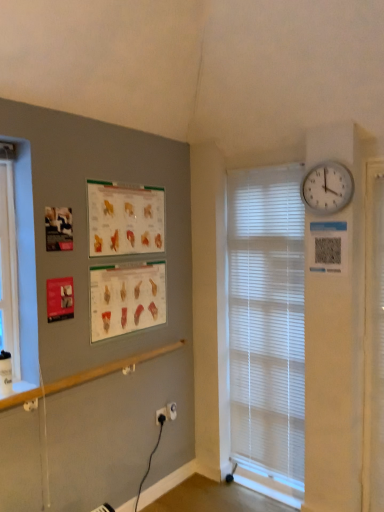
Question: Is white plastic electric outlet at lower center positioned behind white plastic wall clock at upper right?

Choices:
 (A) no
 (B) yes

Answer: (B)

Question: Can you confirm if white plastic electric outlet at lower center is wider than white plastic wall clock at upper right?

Choices:
 (A) yes
 (B) no

Answer: (A)

Question: Is white plastic electric outlet at lower center not close to white plastic wall clock at upper right?

Choices:
 (A) no
 (B) yes

Answer: (B)

Question: From a real-world perspective, is white plastic electric outlet at lower center on top of white plastic wall clock at upper right?

Choices:
 (A) no
 (B) yes

Answer: (A)

Question: Is white plastic electric outlet at lower center positioned in front of white plastic wall clock at upper right?

Choices:
 (A) no
 (B) yes

Answer: (A)

Question: Based on their positions, is white plastic bay window at left located to the left or right of white plastic blinds at center?

Choices:
 (A) left
 (B) right

Answer: (A)

Question: Is white plastic bay window at left bigger or smaller than white plastic blinds at center?

Choices:
 (A) small
 (B) big

Answer: (A)

Question: From a real-world perspective, relative to white plastic blinds at center, is white plastic bay window at left vertically above or below?

Choices:
 (A) above
 (B) below

Answer: (A)

Question: Is point (4, 272) closer or farther from the camera than point (286, 467)?

Choices:
 (A) farther
 (B) closer

Answer: (B)

Question: Is white plastic electric outlet at lower center in front of or behind matte paper poster at center left, which appears as the first poster page when ordered from the bottom, in the image?

Choices:
 (A) front
 (B) behind

Answer: (B)

Question: From the image's perspective, relative to matte paper poster at center left, which appears as the first poster page when ordered from the bottom, is white plastic electric outlet at lower center above or below?

Choices:
 (A) below
 (B) above

Answer: (A)

Question: From a real-world perspective, relative to matte paper poster at center left, which appears as the first poster page when ordered from the bottom, is white plastic electric outlet at lower center vertically above or below?

Choices:
 (A) below
 (B) above

Answer: (A)

Question: Looking at their shapes, would you say white plastic electric outlet at lower center is wider or thinner than matte paper poster at center left, marked as the 2th poster page in a top-to-bottom arrangement?

Choices:
 (A) thin
 (B) wide

Answer: (B)

Question: In the image, is white plastic blinds at center positioned in front of or behind white plastic electric outlet at lower center?

Choices:
 (A) front
 (B) behind

Answer: (A)

Question: Considering the positions of point (289, 302) and point (170, 413), is point (289, 302) closer or farther from the camera than point (170, 413)?

Choices:
 (A) closer
 (B) farther

Answer: (A)